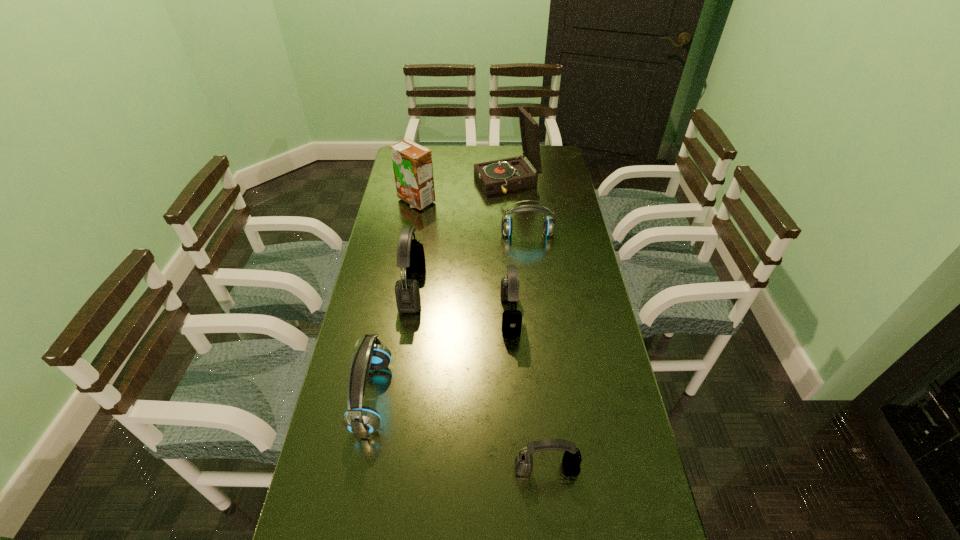
Locate an element on the screen. unoccupied position between the nearest black headset and the tallest object is located at coordinates (527, 326).

This screenshot has height=540, width=960. Identify the location of vacant region between the tallest object and the fourth farthest headset. (440, 290).

Identify the location of vacant area between the nearest object and the tallest object. The width and height of the screenshot is (960, 540). (527, 326).

Identify the location of vacant space that's between the nearest object and the second biggest black headset. The height and width of the screenshot is (540, 960). (528, 392).

Identify which object is the fifth closest to the tallest headset. Please provide its 2D coordinates. Your answer should be formatted as a tuple, i.e. [(x, y)], where the tuple contains the x and y coordinates of a point satisfying the conditions above.

[(499, 176)]

Choose which object is the fifth nearest neighbor to the left blue headset. Please provide its 2D coordinates. Your answer should be formatted as a tuple, i.e. [(x, y)], where the tuple contains the x and y coordinates of a point satisfying the conditions above.

[(412, 163)]

Identify which headset is located as the fourth nearest to the phonograph record. Please provide its 2D coordinates. Your answer should be formatted as a tuple, i.e. [(x, y)], where the tuple contains the x and y coordinates of a point satisfying the conditions above.

[(362, 421)]

Image resolution: width=960 pixels, height=540 pixels. I want to click on headset that is the closest to the smaller blue headset, so click(509, 291).

Identify the location of black headset that is the nearest to the carton. (410, 253).

Identify which black headset is located as the nearest to the second nearest headset. Please provide its 2D coordinates. Your answer should be formatted as a tuple, i.e. [(x, y)], where the tuple contains the x and y coordinates of a point satisfying the conditions above.

[(410, 253)]